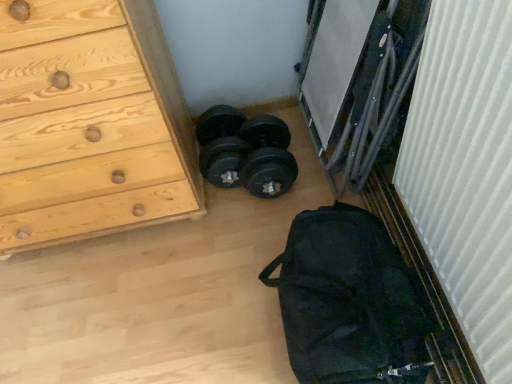
Where is `free space to the left of black fabric bag at lower right`? free space to the left of black fabric bag at lower right is located at coordinates (199, 308).